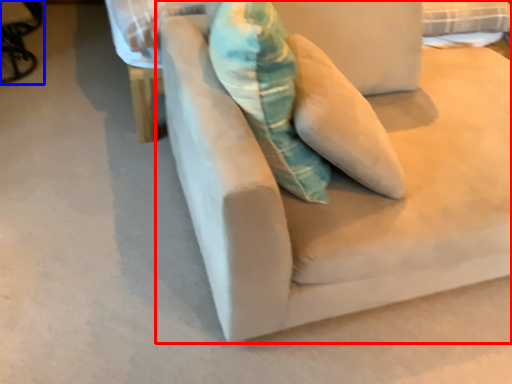
Question: Which object is further to the camera taking this photo, studio couch (highlighted by a red box) or swivel chair (highlighted by a blue box)?

Choices:
 (A) studio couch
 (B) swivel chair

Answer: (B)